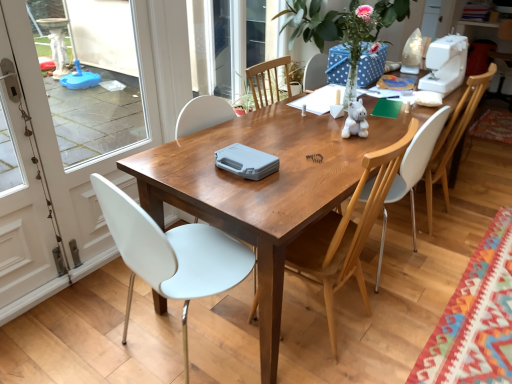
This screenshot has width=512, height=384. I want to click on free space that is in between wooden table at center and multicolored woven mat at lower right, so click(x=437, y=264).